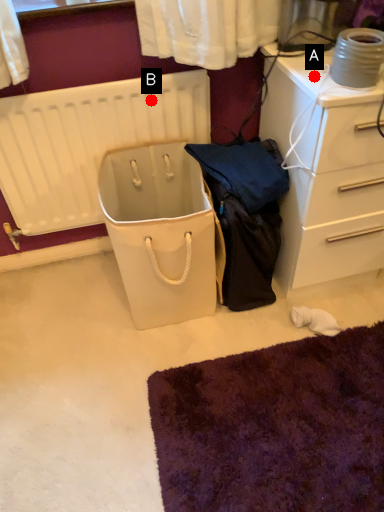
Question: Two points are circled on the image, labeled by A and B beside each circle. Which of the following is the closest to the observer?

Choices:
 (A) A is closer
 (B) B is closer

Answer: (A)